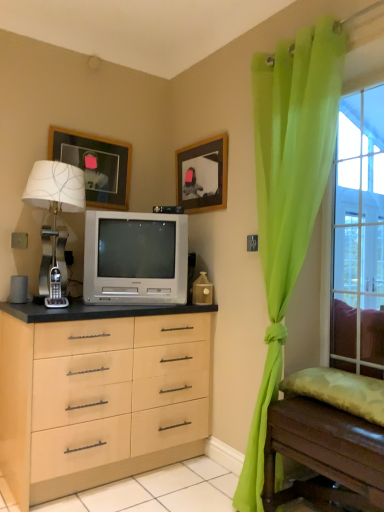
Question: Can you see wooden table at lower right touching clear glass window at right?

Choices:
 (A) yes
 (B) no

Answer: (B)

Question: From a real-world perspective, is wooden table at lower right under clear glass window at right?

Choices:
 (A) yes
 (B) no

Answer: (A)

Question: Is wooden table at lower right aimed at clear glass window at right?

Choices:
 (A) yes
 (B) no

Answer: (B)

Question: Is wooden table at lower right at the left side of clear glass window at right?

Choices:
 (A) no
 (B) yes

Answer: (B)

Question: Considering the relative sizes of wooden table at lower right and clear glass window at right in the image provided, is wooden table at lower right bigger than clear glass window at right?

Choices:
 (A) yes
 (B) no

Answer: (A)

Question: From the image's perspective, is silver metallic table lamp at left above or below wooden table at lower right?

Choices:
 (A) below
 (B) above

Answer: (B)

Question: Do you think silver metallic table lamp at left is within wooden table at lower right, or outside of it?

Choices:
 (A) outside
 (B) inside

Answer: (A)

Question: Looking at the image, does silver metallic table lamp at left seem bigger or smaller compared to wooden table at lower right?

Choices:
 (A) small
 (B) big

Answer: (A)

Question: Is silver metallic table lamp at left taller or shorter than wooden table at lower right?

Choices:
 (A) short
 (B) tall

Answer: (B)

Question: Would you say silver metallic table lamp at left is inside or outside wooden picture frame at upper left, arranged as the 2th picture frame when viewed from the right?

Choices:
 (A) inside
 (B) outside

Answer: (B)

Question: From the image's perspective, is silver metallic table lamp at left above or below wooden picture frame at upper left, the first picture frame when ordered from left to right?

Choices:
 (A) below
 (B) above

Answer: (A)

Question: Is silver metallic table lamp at left to the left or to the right of wooden picture frame at upper left, arranged as the 2th picture frame when viewed from the right, in the image?

Choices:
 (A) left
 (B) right

Answer: (A)

Question: Is silver metallic table lamp at left bigger or smaller than wooden picture frame at upper left, the first picture frame when ordered from left to right?

Choices:
 (A) big
 (B) small

Answer: (A)

Question: Is point (114, 159) closer or farther from the camera than point (249, 438)?

Choices:
 (A) farther
 (B) closer

Answer: (A)

Question: In terms of height, does wooden picture frame at upper left, the first picture frame when ordered from left to right, look taller or shorter compared to green sheer curtain at right?

Choices:
 (A) short
 (B) tall

Answer: (A)